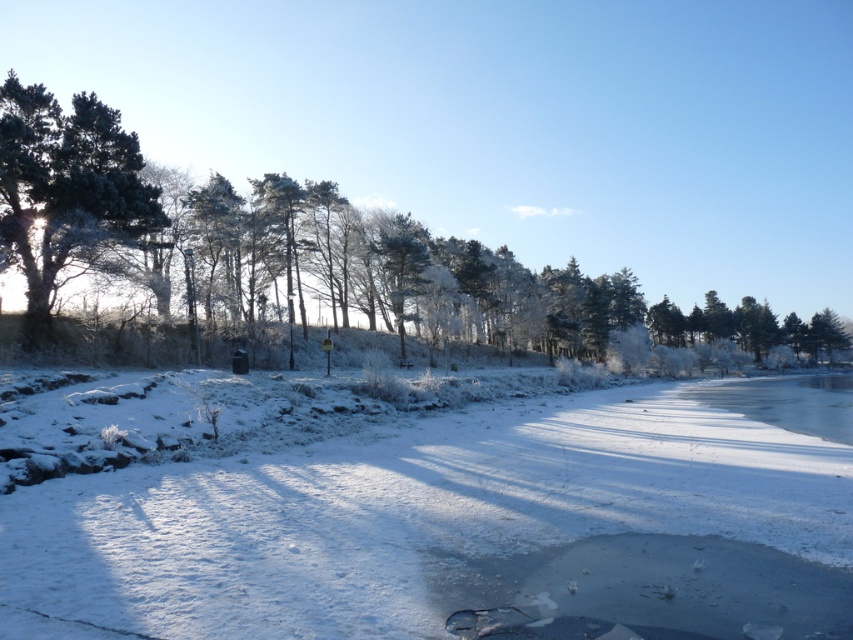
Question: Can you confirm if green frosted tree at left is wider than frosted glass tree at center?

Choices:
 (A) yes
 (B) no

Answer: (A)

Question: Which of the following is the closest to the observer?

Choices:
 (A) (181, 570)
 (B) (389, 250)
 (C) (38, 204)

Answer: (A)

Question: From the image, what is the correct spatial relationship of white frosty snow at center in relation to glossy dark green tree at upper left?

Choices:
 (A) below
 (B) above

Answer: (A)

Question: Does green frosted tree at left come behind glossy dark green tree at upper left?

Choices:
 (A) no
 (B) yes

Answer: (B)

Question: Which object is closer to the camera taking this photo?

Choices:
 (A) frosted glass tree at center
 (B) green frosted tree at left
 (C) glossy dark green tree at upper left

Answer: (C)

Question: Which point is farther to the camera?

Choices:
 (A) frosted glass tree at center
 (B) green frosted tree at left

Answer: (A)